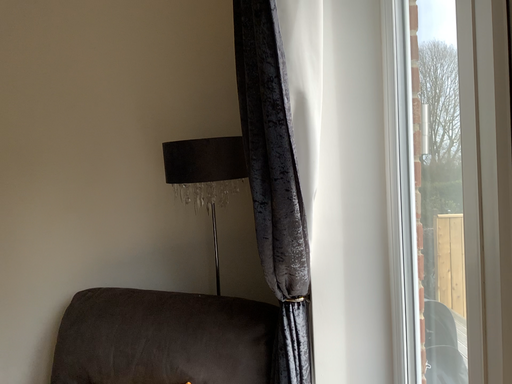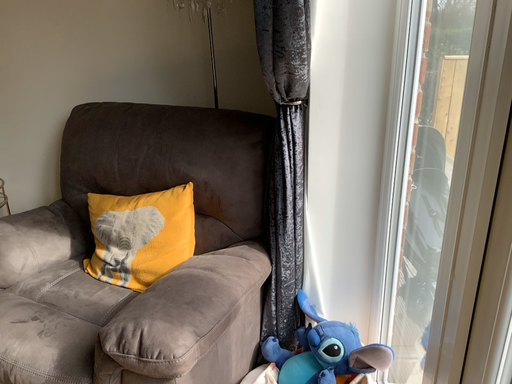
Question: Which way did the camera rotate in the video?

Choices:
 (A) rotated downward
 (B) rotated upward

Answer: (A)